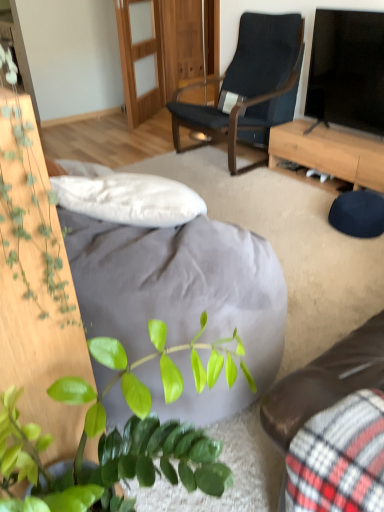
Question: Would you say black glossy tv at upper right is part of velvet plaid studio couch at lower right's contents?

Choices:
 (A) yes
 (B) no

Answer: (B)

Question: Considering the relative sizes of velvet plaid studio couch at lower right and black glossy tv at upper right in the image provided, is velvet plaid studio couch at lower right smaller than black glossy tv at upper right?

Choices:
 (A) no
 (B) yes

Answer: (B)

Question: Is velvet plaid studio couch at lower right to the right of black glossy tv at upper right from the viewer's perspective?

Choices:
 (A) no
 (B) yes

Answer: (A)

Question: From a real-world perspective, is velvet plaid studio couch at lower right physically above black glossy tv at upper right?

Choices:
 (A) yes
 (B) no

Answer: (B)

Question: From a real-world perspective, is velvet plaid studio couch at lower right located beneath black glossy tv at upper right?

Choices:
 (A) no
 (B) yes

Answer: (B)

Question: Considering their positions, is velvet plaid studio couch at lower right located in front of or behind green matte plant at lower left?

Choices:
 (A) behind
 (B) front

Answer: (B)

Question: Considering the positions of velvet plaid studio couch at lower right and green matte plant at lower left in the image, is velvet plaid studio couch at lower right taller or shorter than green matte plant at lower left?

Choices:
 (A) short
 (B) tall

Answer: (A)

Question: Is velvet plaid studio couch at lower right to the left or to the right of green matte plant at lower left in the image?

Choices:
 (A) right
 (B) left

Answer: (A)

Question: From the image's perspective, is velvet plaid studio couch at lower right above or below green matte plant at lower left?

Choices:
 (A) above
 (B) below

Answer: (B)

Question: Considering the positions of green leafy plant at left and black glossy tv at upper right in the image, is green leafy plant at left taller or shorter than black glossy tv at upper right?

Choices:
 (A) tall
 (B) short

Answer: (B)

Question: Considering the positions of green leafy plant at left and black glossy tv at upper right in the image, is green leafy plant at left wider or thinner than black glossy tv at upper right?

Choices:
 (A) thin
 (B) wide

Answer: (A)

Question: Considering their positions, is green leafy plant at left located in front of or behind black glossy tv at upper right?

Choices:
 (A) front
 (B) behind

Answer: (A)

Question: In the image, is green leafy plant at left on the left side or the right side of black glossy tv at upper right?

Choices:
 (A) right
 (B) left

Answer: (B)

Question: From a real-world perspective, is green leafy plant at left above or below light brown wood desk at center right?

Choices:
 (A) below
 (B) above

Answer: (B)

Question: Would you say green leafy plant at left is inside or outside light brown wood desk at center right?

Choices:
 (A) outside
 (B) inside

Answer: (A)